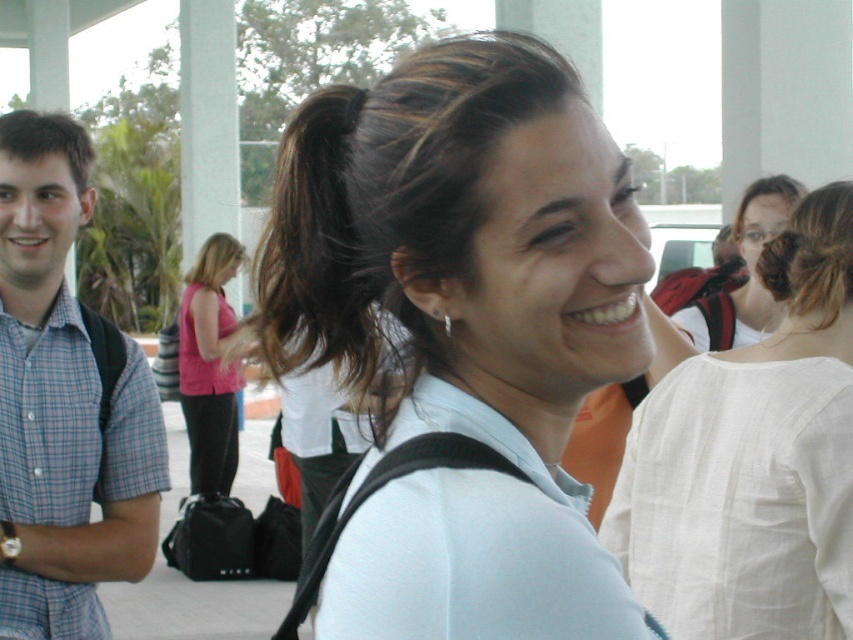
In the image, there is a point marked at coordinates (752, 467). Which object from the list is located at this point?

The white cotton blouse at upper right is located at point (752, 467).